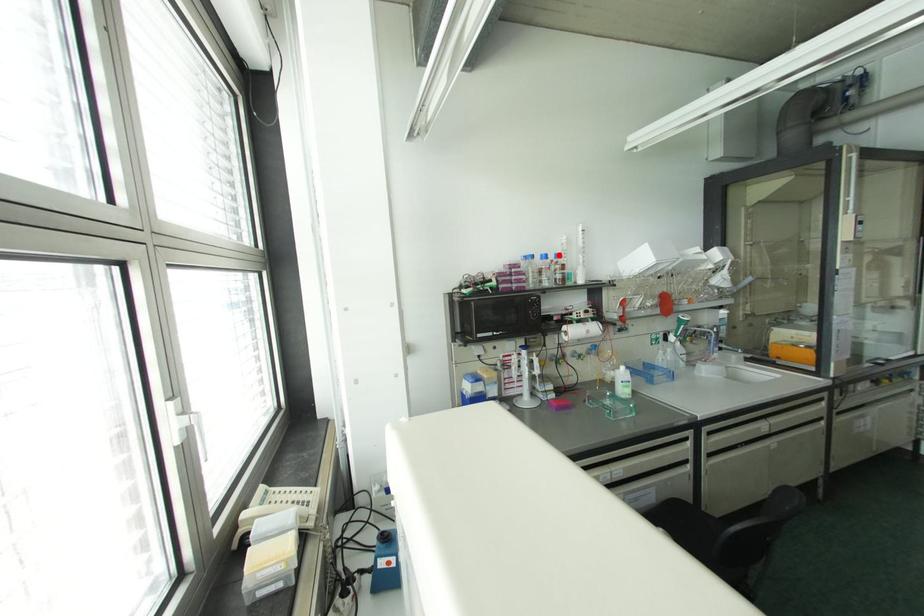
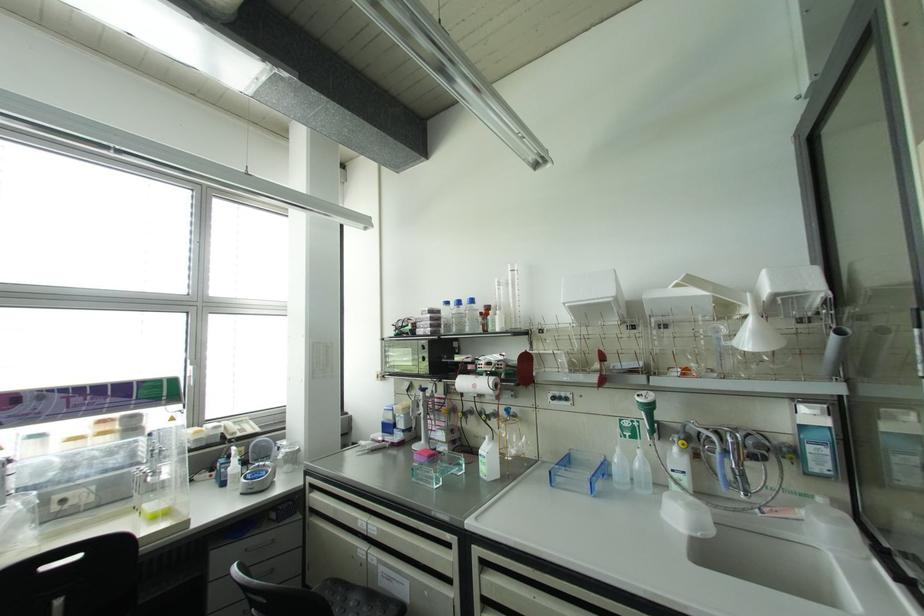
The point at the highlighted location is marked in the first image. Where is the corresponding point in the second image?

(471, 301)